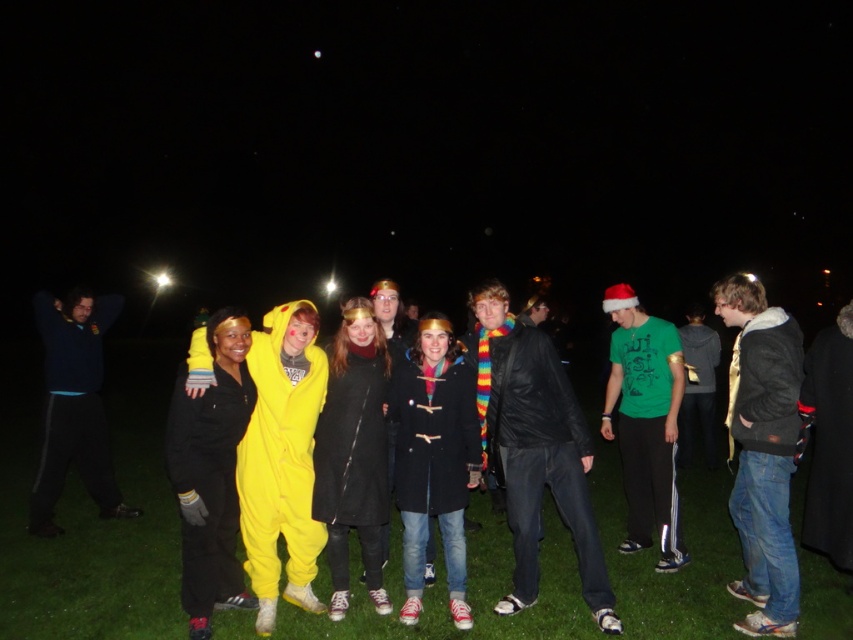
You are standing at the edge of the grassy area and want to place a 3 meter long banner on the green grass at center. Can you fit the banner on the grass without it overlapping the edges?

The green grass at center is 5.05 meters from viewer. The banner is 3 meters long, so it can be placed on the grass as it is shorter than the grass area. However, the distance from the viewer to the grass is 5.05 meters, which may affect placement but does not directly impact the banner fitting on the grass itself. The banner can be placed without overlapping edges if positioned correctly.

You are taking a photo of the scene and want to focus on both the point at (724, 550) and the point at (635, 336). Which point is closer to the camera?

Point (724, 550) is further to the camera than point (635, 336), so the point at (635, 336) is closer to the camera.